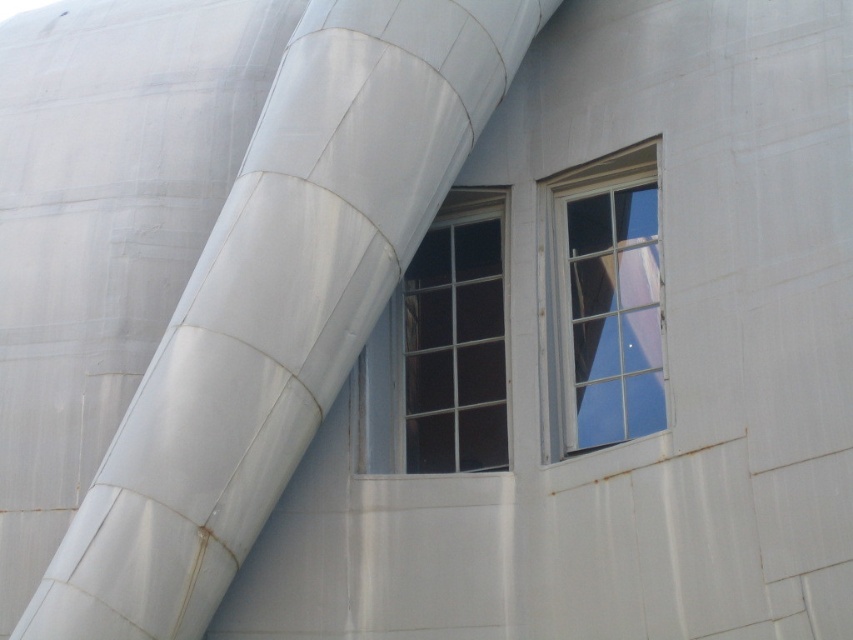
Is point (421, 323) less distant than point (590, 435)?

No.

Between clear glass window at center and clear glass window at upper right, which one has less height?

Standing shorter between the two is clear glass window at center.

Locate an element on the screen. The height and width of the screenshot is (640, 853). clear glass window at center is located at coordinates (442, 349).